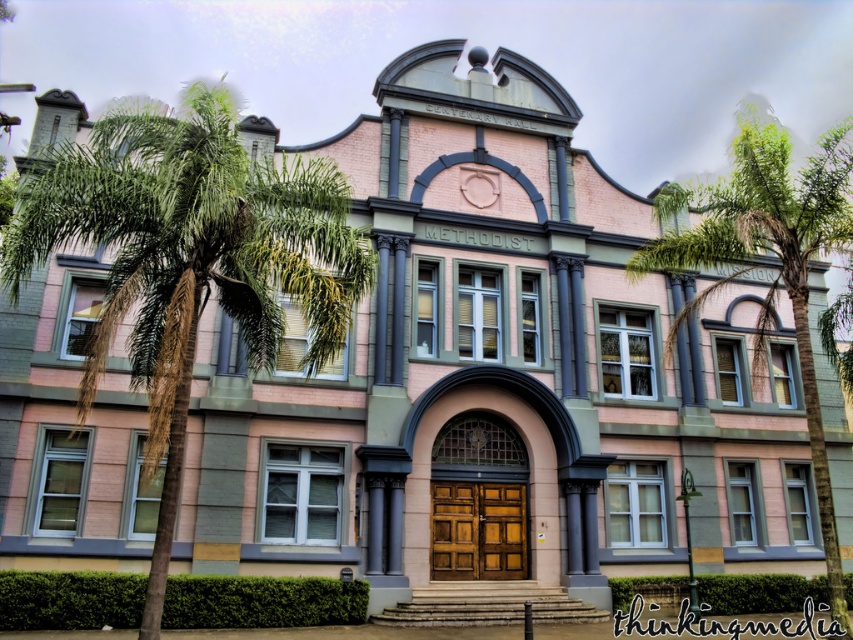
Is green leafy palm tree at left below green leafy palm tree at right?

No, green leafy palm tree at left is not below green leafy palm tree at right.

Is green leafy palm tree at left behind green leafy palm tree at right?

That is False.

Which is in front, point (123, 246) or point (809, 401)?

Point (123, 246) is more forward.

At what (x,y) coordinates should I click in order to perform the action: click on green leafy palm tree at left. Please return your answer as a coordinate pair (x, y). Looking at the image, I should click on (189, 260).